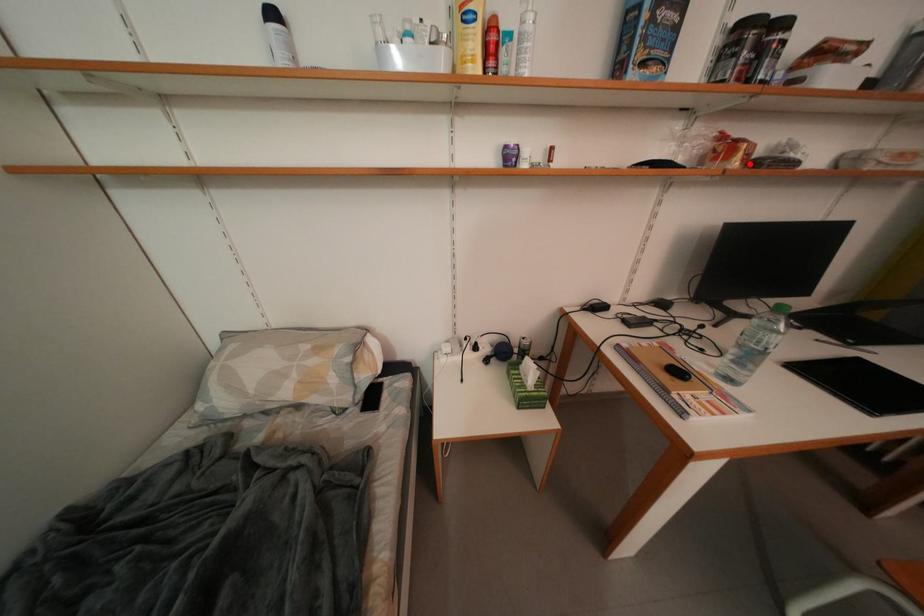
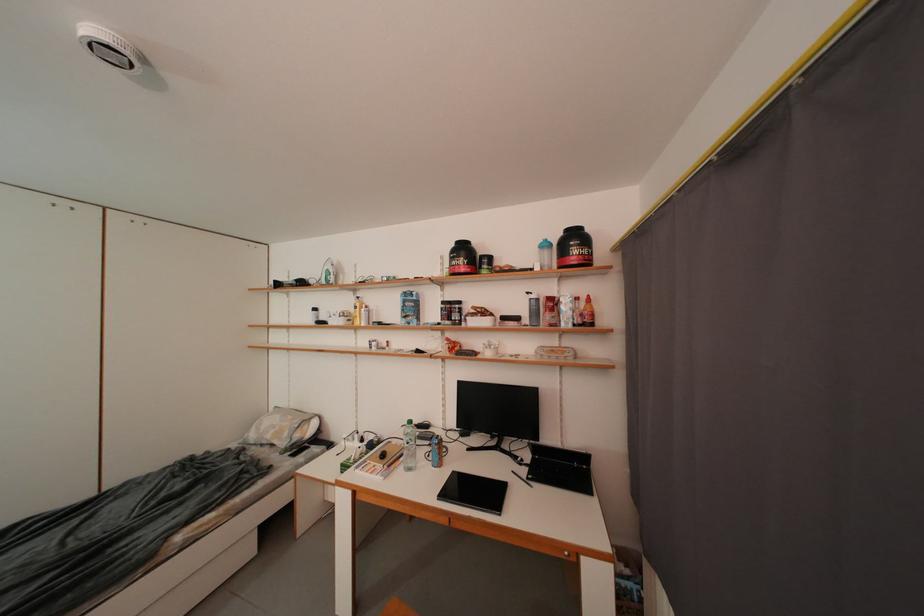
Where in the second image is the point corresponding to the highlighted location from the first image?

(457, 355)